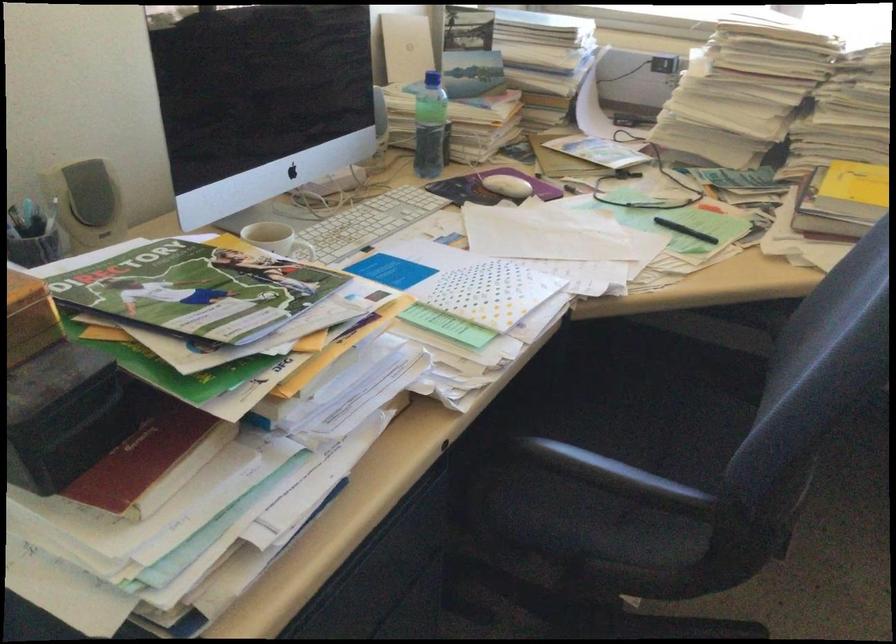
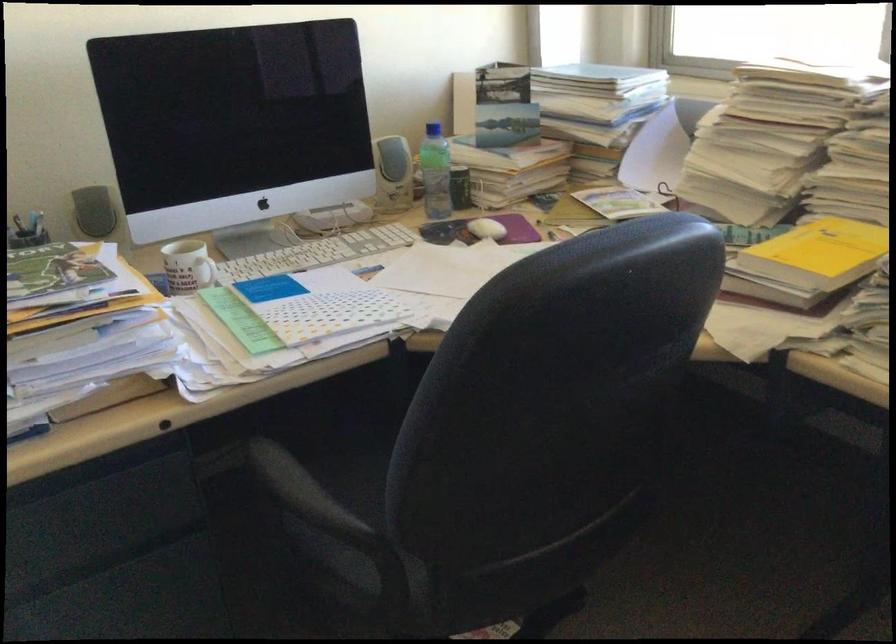
In the second image, find the point that corresponds to point (678, 506) in the first image.

(314, 521)